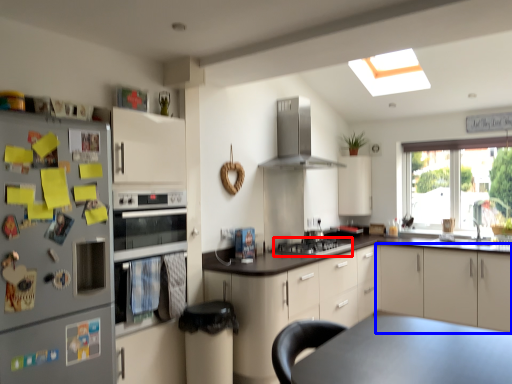
Question: Which of the following is the farthest to the observer, gas stove (highlighted by a red box) or cabinetry (highlighted by a blue box)?

Choices:
 (A) gas stove
 (B) cabinetry

Answer: (B)